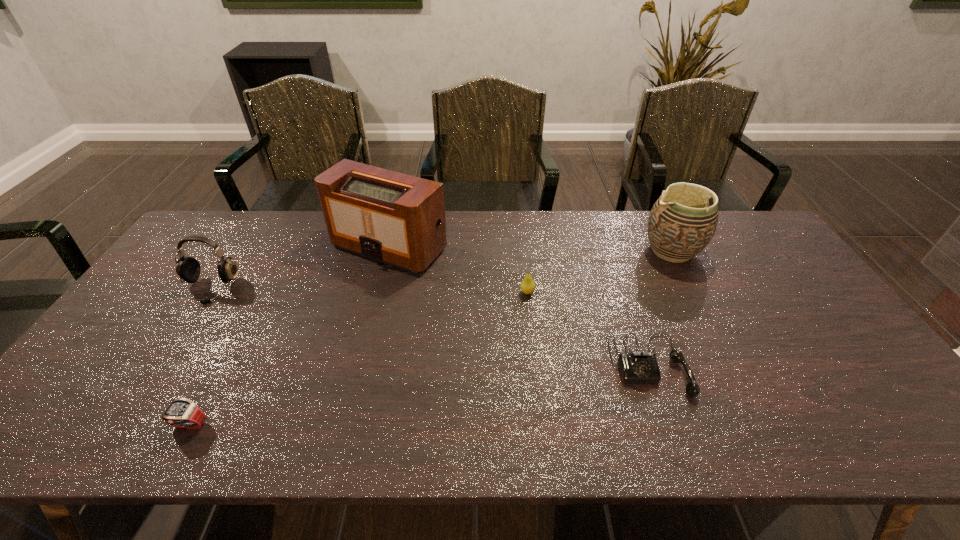
I want to click on vacant space at the near edge, so click(x=221, y=443).

In the image, there is a desktop. At what (x,y) coordinates should I click in order to perform the action: click on free space at the left edge. Please return your answer as a coordinate pair (x, y). The image size is (960, 540). Looking at the image, I should click on (194, 256).

Where is `vacant space at the near left corner`? The height and width of the screenshot is (540, 960). vacant space at the near left corner is located at coordinates (49, 422).

The image size is (960, 540). I want to click on vacant region between the second object from right to left and the radio receiver, so click(519, 306).

This screenshot has width=960, height=540. Find the location of `vacant point located between the headset and the second nearest object`. vacant point located between the headset and the second nearest object is located at coordinates (429, 327).

Identify the location of empty space that is in between the headset and the fourth object from right to left. This screenshot has height=540, width=960. tap(300, 268).

The width and height of the screenshot is (960, 540). What are the coordinates of `vacant space that is in between the leftmost object and the nearest object` in the screenshot? It's located at (200, 357).

Locate an element on the screen. The width and height of the screenshot is (960, 540). vacant point located between the leftmost object and the pear is located at coordinates (369, 291).

Identify the location of free point between the fourth object from left to right and the fourth shortest object. The width and height of the screenshot is (960, 540). (369, 291).

Where is `vacant region between the rightmost object and the fourth object from right to left`? vacant region between the rightmost object and the fourth object from right to left is located at coordinates (530, 249).